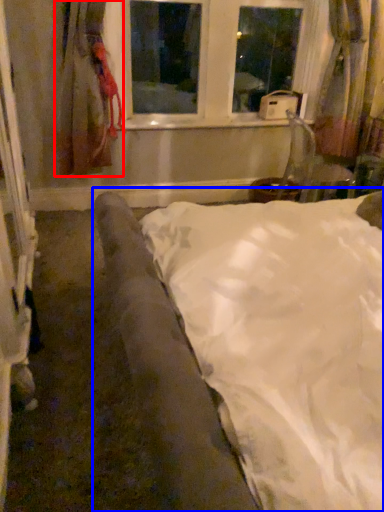
Question: Which point is further to the camera, curtain (highlighted by a red box) or bed (highlighted by a blue box)?

Choices:
 (A) curtain
 (B) bed

Answer: (A)